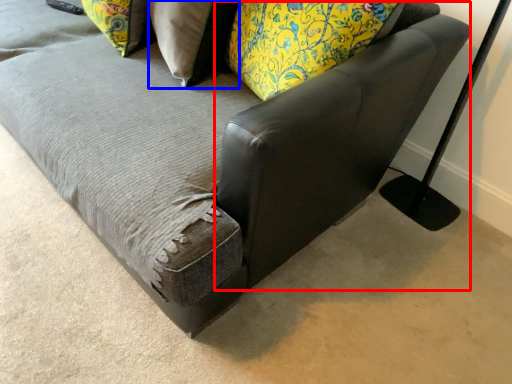
Question: Among these objects, which one is nearest to the camera, swivel chair (highlighted by a red box) or pillow (highlighted by a blue box)?

Choices:
 (A) swivel chair
 (B) pillow

Answer: (A)